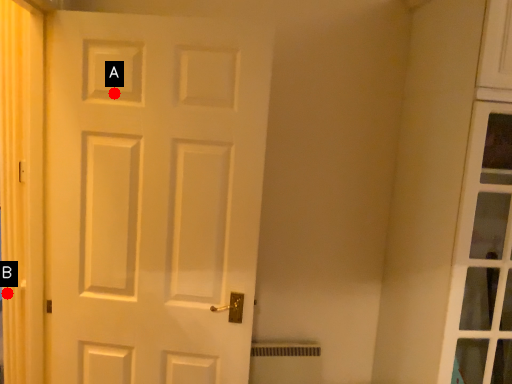
Question: Two points are circled on the image, labeled by A and B beside each circle. Among these points, which one is nearest to the camera?

Choices:
 (A) A is closer
 (B) B is closer

Answer: (A)